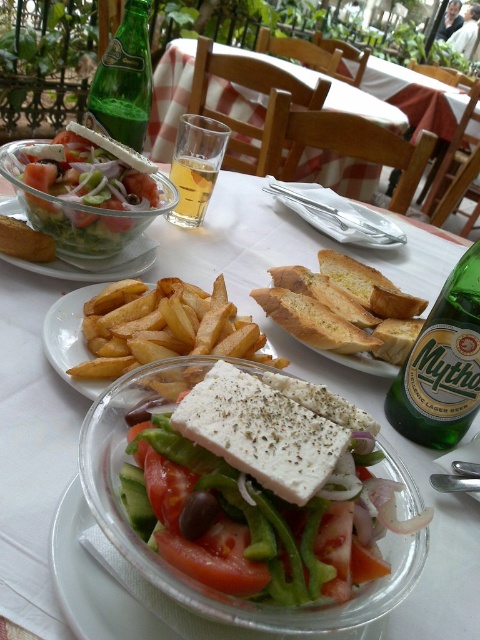
Question: Can you confirm if white crumbly cheese at center is thinner than golden crispy fries at center?

Choices:
 (A) no
 (B) yes

Answer: (B)

Question: Does red matte tomato at center have a larger size compared to translucent glass at upper center?

Choices:
 (A) no
 (B) yes

Answer: (A)

Question: Estimate the real-world distances between objects in this image. Which object is closer to the white porcelain plate at center?

Choices:
 (A) fresh green salad at upper left
 (B) white crumbly cheese at center
 (C) green glass bottle at upper right
 (D) clear glass bowl at center

Answer: (C)

Question: Which point is closer to the camera?

Choices:
 (A) (107, 241)
 (B) (251, 593)
 (C) (140, 92)

Answer: (B)

Question: Is white creamy feta cheese at center above clear glass bowl at center?

Choices:
 (A) no
 (B) yes

Answer: (A)

Question: Among these points, which one is farthest from the camera?

Choices:
 (A) (396, 232)
 (B) (60, 298)
 (C) (26, 141)
 (D) (411, 419)

Answer: (A)